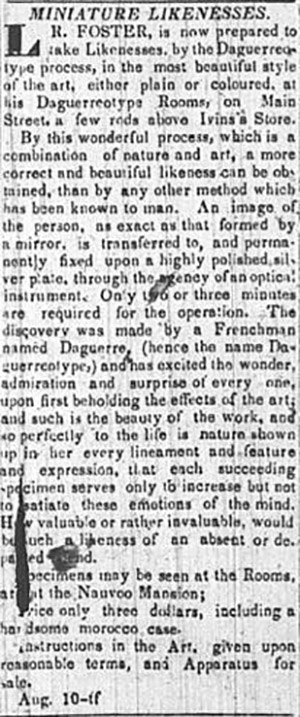
Identify the location of art. The width and height of the screenshot is (300, 717). (173, 644).